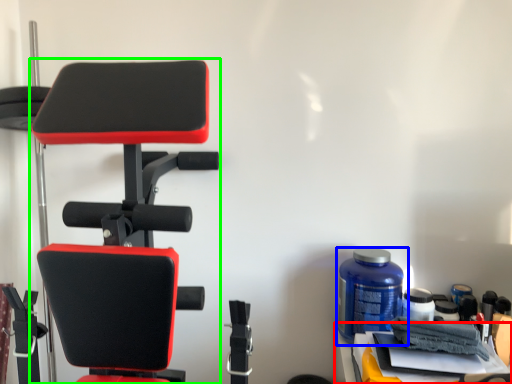
Question: Which object is the farthest from table (highlighted by a red box)? Choose among these: bottle (highlighted by a blue box) or chair (highlighted by a green box).

Choices:
 (A) bottle
 (B) chair

Answer: (B)